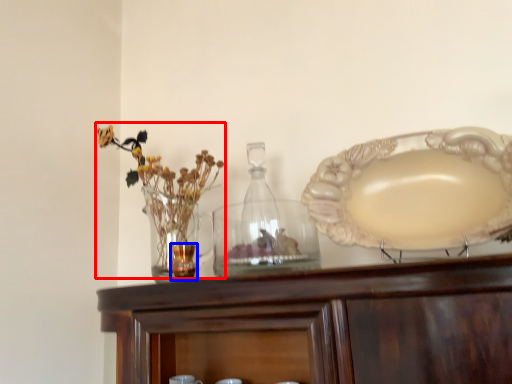
Question: Which object is closer to the camera taking this photo, floral arrangement (highlighted by a red box) or tableware (highlighted by a blue box)?

Choices:
 (A) floral arrangement
 (B) tableware

Answer: (B)